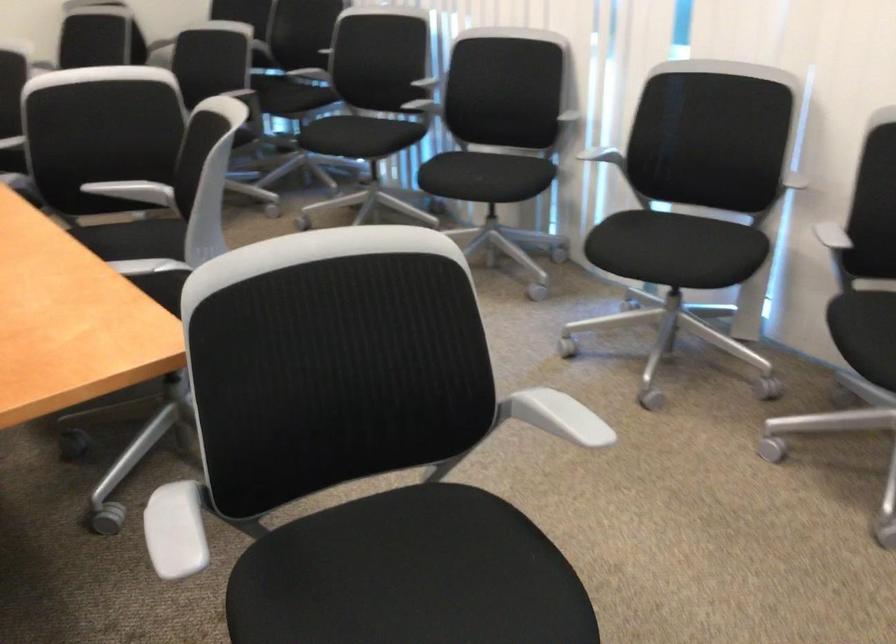
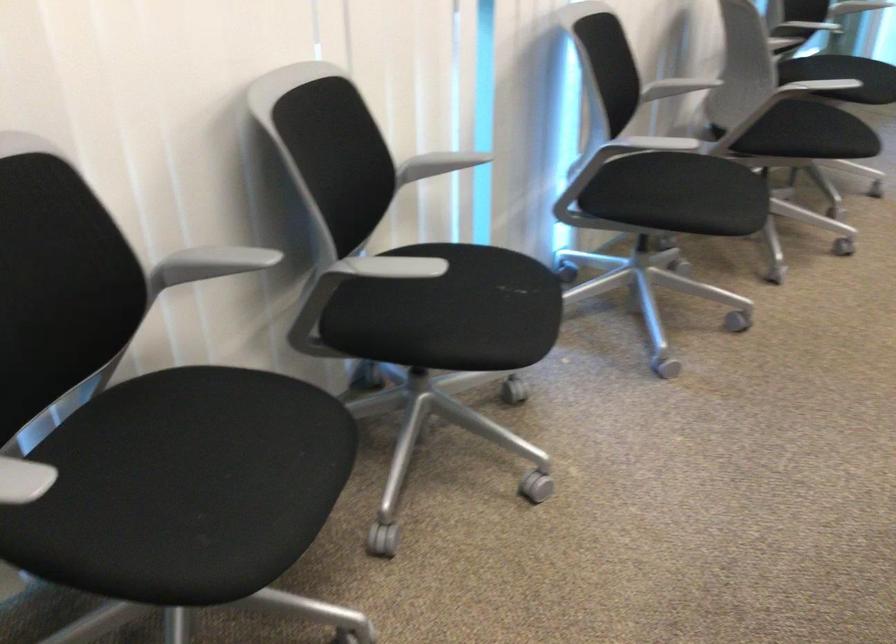
In the second image, find the point that corresponds to point (423, 82) in the first image.

(211, 263)